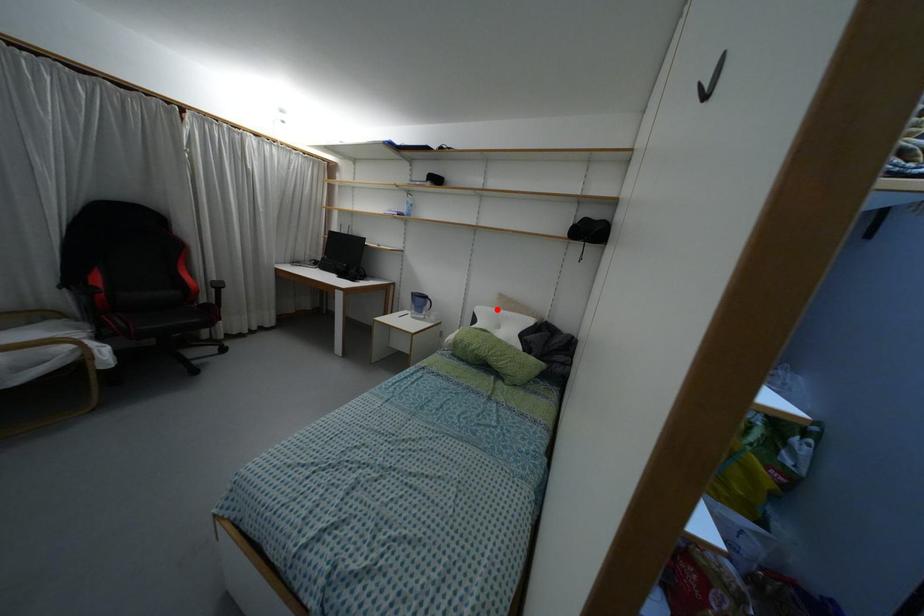
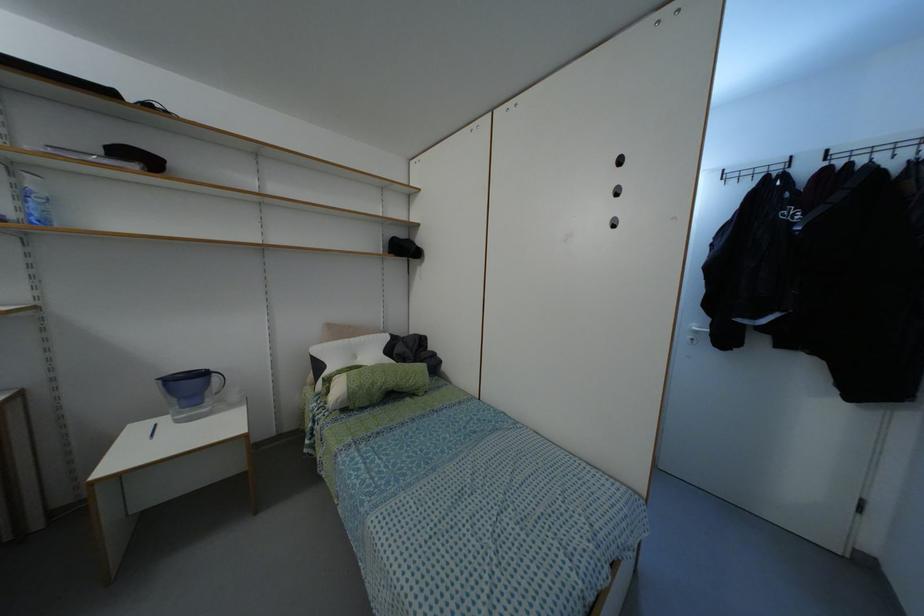
The point at the highlighted location is marked in the first image. Where is the corresponding point in the second image?

(345, 339)